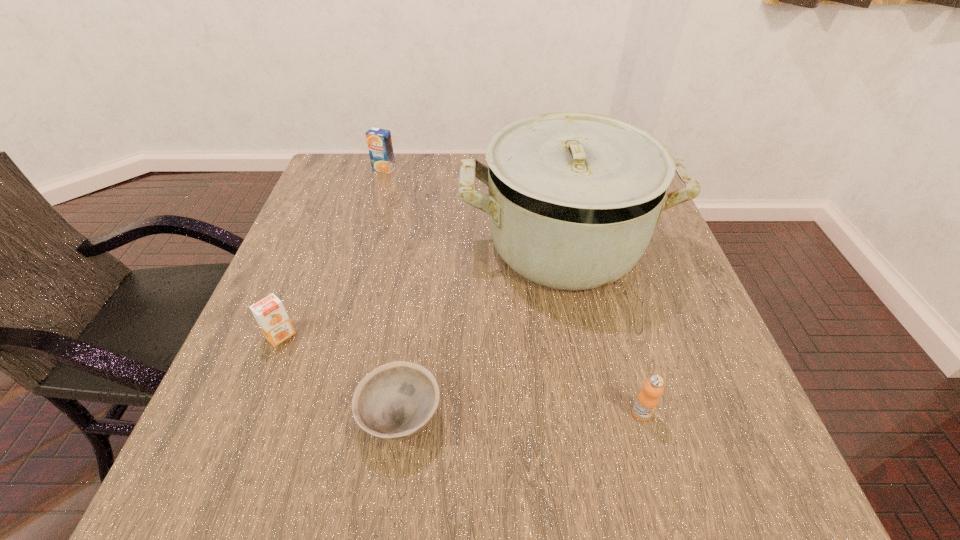
Find the location of a particular element. free space that satisfies the following two spatial constraints: 1. on the back side of the second orange juice from right to left; 2. on the left side of the third farthest object is located at coordinates (348, 169).

Find the location of a particular element. The image size is (960, 540). vacant space that satisfies the following two spatial constraints: 1. on the back side of the leftmost orange juice; 2. on the left side of the fourth nearest object is located at coordinates (318, 245).